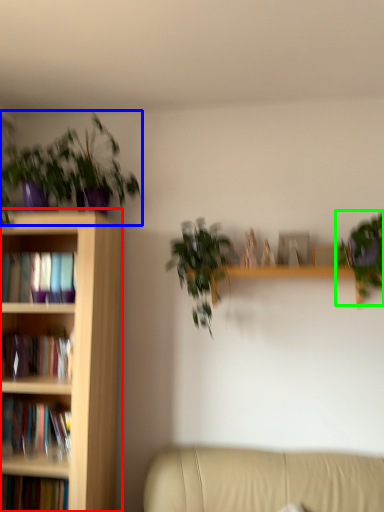
Question: Considering the real-world distances, which object is farthest from bookcase (highlighted by a red box)? houseplant (highlighted by a blue box) or houseplant (highlighted by a green box)?

Choices:
 (A) houseplant
 (B) houseplant

Answer: (B)